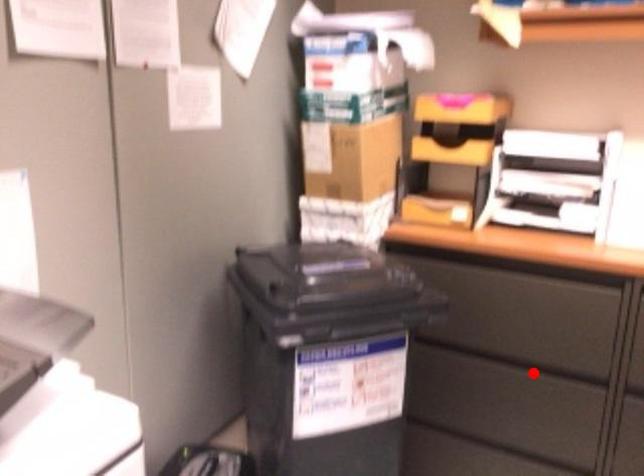
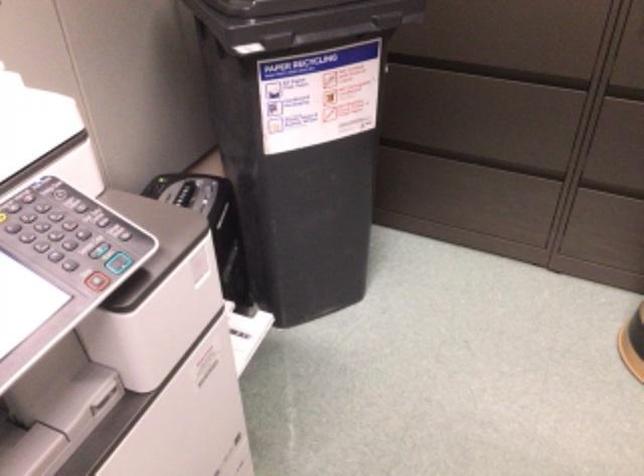
Where in the second image is the point corresponding to the highlighted location from the first image?

(507, 73)